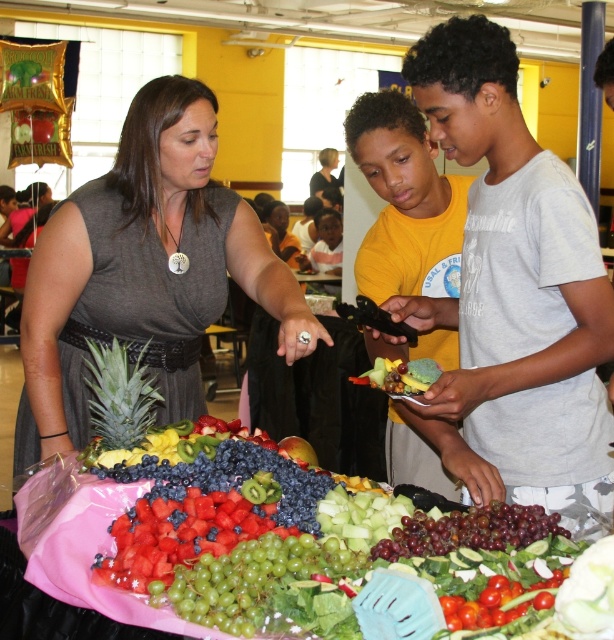
Question: Which object is the farthest from the red matte watermelon at center?

Choices:
 (A) shiny red apple at center
 (B) green textured pineapple at left
 (C) green matte grapes at center
 (D) matte gray t-shirt at center

Answer: (D)

Question: Can you confirm if green textured pineapple at left is wider than shiny yellow banana at center?

Choices:
 (A) yes
 (B) no

Answer: (A)

Question: Is matte gray t-shirt at center behind shiny red apple at center?

Choices:
 (A) yes
 (B) no

Answer: (B)

Question: Which of the following is the farthest from the observer?

Choices:
 (A) (195, 488)
 (B) (286, 442)
 (C) (286, 609)
 (D) (128, 385)

Answer: (B)

Question: Among these points, which one is nearest to the camera?

Choices:
 (A) (354, 381)
 (B) (338, 547)

Answer: (B)

Question: Does matte gray t-shirt at center have a greater width compared to red matte watermelon at center?

Choices:
 (A) no
 (B) yes

Answer: (B)